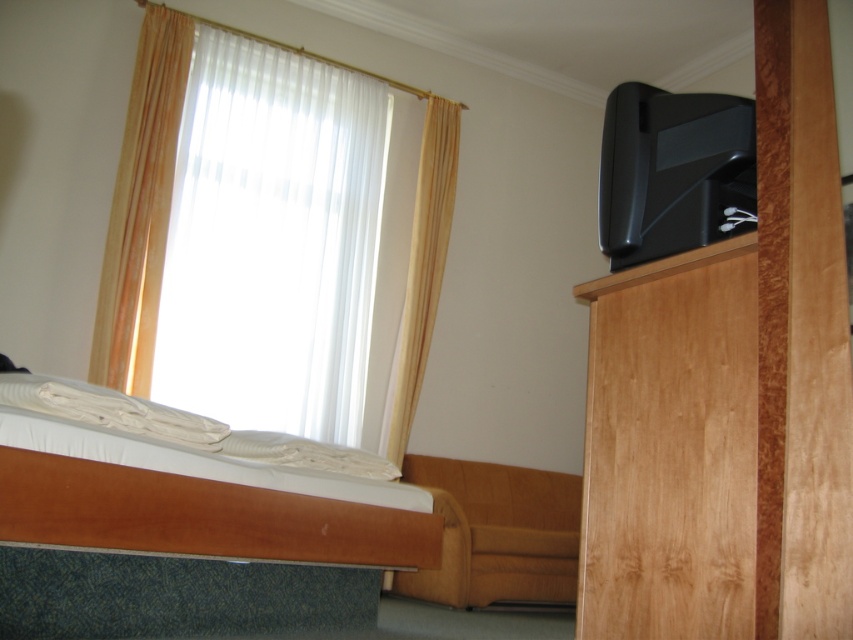
Question: Which point is farther from the camera taking this photo?

Choices:
 (A) (201, 68)
 (B) (120, 285)
 (C) (218, 560)
 (D) (409, 417)

Answer: (D)

Question: Is white matte bed at lower left bigger than beige fabric curtain at upper left?

Choices:
 (A) no
 (B) yes

Answer: (B)

Question: From the image, what is the correct spatial relationship of white matte bed at lower left in relation to orange sheer curtain at left?

Choices:
 (A) above
 (B) below

Answer: (B)

Question: Which object is positioned closest to the beige fabric curtain at upper left?

Choices:
 (A) white sheer curtain at upper left
 (B) orange sheer curtain at left
 (C) white matte bed at lower left

Answer: (A)

Question: Among these objects, which one is nearest to the camera?

Choices:
 (A) beige fabric curtain at upper left
 (B) white sheer curtain at upper left
 (C) white matte bed at lower left
 (D) orange sheer curtain at left

Answer: (C)

Question: Can you confirm if white sheer curtain at upper left is smaller than beige fabric curtain at upper left?

Choices:
 (A) no
 (B) yes

Answer: (A)